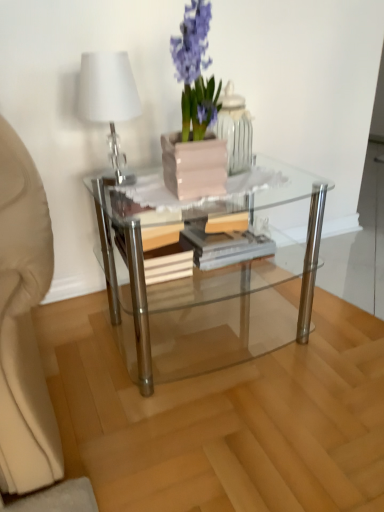
What do you see at coordinates (235, 129) in the screenshot?
I see `pink glossy vase at upper center` at bounding box center [235, 129].

Image resolution: width=384 pixels, height=512 pixels. What do you see at coordinates (109, 99) in the screenshot?
I see `white glossy table lamp at upper left` at bounding box center [109, 99].

You are a GUI agent. You are given a task and a screenshot of the screen. Output one action in this format:
    pyautogui.click(x=<x>, y=<y>)
    Task: Click on the wooden at center
    This screenshot has height=512, width=384.
    Given the screenshot: What is the action you would take?
    pyautogui.click(x=200, y=247)

The width and height of the screenshot is (384, 512). Identify the location of transparent glass coffee table at center. (203, 278).

Would you say transparent glass coffee table at center is a long distance from white glossy table lamp at upper left?

transparent glass coffee table at center is near white glossy table lamp at upper left, not far away.

Can we say transparent glass coffee table at center lies outside white glossy table lamp at upper left?

transparent glass coffee table at center lies outside white glossy table lamp at upper left's area.

The height and width of the screenshot is (512, 384). In order to click on coffee table on the right of white glossy table lamp at upper left in this screenshot , I will do `click(203, 278)`.

Which object is closer to the camera, transparent glass coffee table at center or white glossy table lamp at upper left?

transparent glass coffee table at center is more forward.

From the picture: Which point is more distant from viewer, (82, 109) or (191, 168)?

Positioned behind is point (82, 109).

Considering the relative positions of white glossy table lamp at upper left and matte pink pot at center in the image provided, is white glossy table lamp at upper left to the left of matte pink pot at center from the viewer's perspective?

Indeed, white glossy table lamp at upper left is positioned on the left side of matte pink pot at center.

From a real-world perspective, is white glossy table lamp at upper left above or below matte pink pot at center?

white glossy table lamp at upper left is below matte pink pot at center.

Which is correct: transparent glass coffee table at center is inside pink glossy vase at upper center, or outside of it?

The correct answer is: outside.

Is point (156, 368) farther from viewer compared to point (227, 97)?

Yes, point (156, 368) is farther from viewer.

Image resolution: width=384 pixels, height=512 pixels. I want to click on glass vase located on the right of transparent glass coffee table at center, so [x=235, y=129].

Based on their positions, is transparent glass coffee table at center located to the left or right of pink glossy vase at upper center?

transparent glass coffee table at center is to the left of pink glossy vase at upper center.

Looking at their sizes, would you say transparent glass coffee table at center is wider or thinner than matte pink pot at center?

transparent glass coffee table at center is wider than matte pink pot at center.

Is transparent glass coffee table at center oriented away from matte pink pot at center?

No.

Which object is closer to the camera taking this photo, transparent glass coffee table at center or matte pink pot at center?

matte pink pot at center is in front.

From a real-world perspective, who is located lower, transparent glass coffee table at center or matte pink pot at center?

transparent glass coffee table at center is physically lower.

Does wooden at center have a larger size compared to white glossy table lamp at upper left?

Indeed, wooden at center has a larger size compared to white glossy table lamp at upper left.

Measure the distance between wooden at center and white glossy table lamp at upper left.

11.06 inches.

Can you tell me how much wooden at center and white glossy table lamp at upper left differ in facing direction?

wooden at center and white glossy table lamp at upper left are facing 2.49 degrees away from each other.

From a real-world perspective, which is physically above, wooden at center or white glossy table lamp at upper left?

white glossy table lamp at upper left.

Are pink glossy vase at upper center and wooden at center located far from each other?

No.

Looking at this image, considering the positions of objects pink glossy vase at upper center and wooden at center in the image provided, who is more to the right, pink glossy vase at upper center or wooden at center?

pink glossy vase at upper center is more to the right.

Identify the location of book on the left of pink glossy vase at upper center. (200, 247).

Which object is positioned more to the left, wooden at center or pink glossy vase at upper center?

Positioned to the left is wooden at center.

In the scene shown: Are wooden at center and pink glossy vase at upper center located far from each other?

Actually, wooden at center and pink glossy vase at upper center are a little close together.

Considering the relative sizes of wooden at center and pink glossy vase at upper center in the image provided, is wooden at center thinner than pink glossy vase at upper center?

No, wooden at center is not thinner than pink glossy vase at upper center.

Is wooden at center turned away from pink glossy vase at upper center?

That's not correct — wooden at center is not looking away from pink glossy vase at upper center.

In order to click on table lamp positioned vertically above the transparent glass coffee table at center (from a real-world perspective) in this screenshot , I will do `click(109, 99)`.

This screenshot has width=384, height=512. Find the location of `table lamp on the left of matte pink pot at center`. table lamp on the left of matte pink pot at center is located at coordinates (109, 99).

Estimate the real-world distances between objects in this image. Which object is further from transparent glass coffee table at center, pink glossy vase at upper center or matte pink pot at center?

Based on the image, pink glossy vase at upper center appears to be further to transparent glass coffee table at center.

From the picture: Considering their positions, is wooden at center positioned further to transparent glass coffee table at center than pink glossy vase at upper center?

The object further to transparent glass coffee table at center is pink glossy vase at upper center.

From the image, which object appears to be farther from wooden at center, pink glossy vase at upper center or white glossy table lamp at upper left?

white glossy table lamp at upper left is positioned further to the anchor wooden at center.

Which object lies further to the anchor point white glossy table lamp at upper left, wooden at center or transparent glass coffee table at center?

transparent glass coffee table at center is positioned further to the anchor white glossy table lamp at upper left.

Which object lies further to the anchor point pink glossy vase at upper center, matte pink pot at center or transparent glass coffee table at center?

The object further to pink glossy vase at upper center is transparent glass coffee table at center.

From the image, which object appears to be nearer to pink glossy vase at upper center, wooden at center or matte pink pot at center?

matte pink pot at center lies closer to pink glossy vase at upper center than the other object.

Estimate the real-world distances between objects in this image. Which object is closer to wooden at center, transparent glass coffee table at center or matte pink pot at center?

transparent glass coffee table at center.

Estimate the real-world distances between objects in this image. Which object is closer to transparent glass coffee table at center, matte pink pot at center or pink glossy vase at upper center?

matte pink pot at center.

The width and height of the screenshot is (384, 512). Identify the location of houseplant between pink glossy vase at upper center and wooden at center from top to bottom. [x=195, y=71].

I want to click on houseplant between white glossy table lamp at upper left and pink glossy vase at upper center in the horizontal direction, so click(x=195, y=71).

Where is `book between white glossy table lamp at upper left and transparent glass coffee table at center in the up-down direction`? book between white glossy table lamp at upper left and transparent glass coffee table at center in the up-down direction is located at coordinates (200, 247).

What are the coordinates of `houseplant that lies between pink glossy vase at upper center and transparent glass coffee table at center from top to bottom` in the screenshot? It's located at (195, 71).